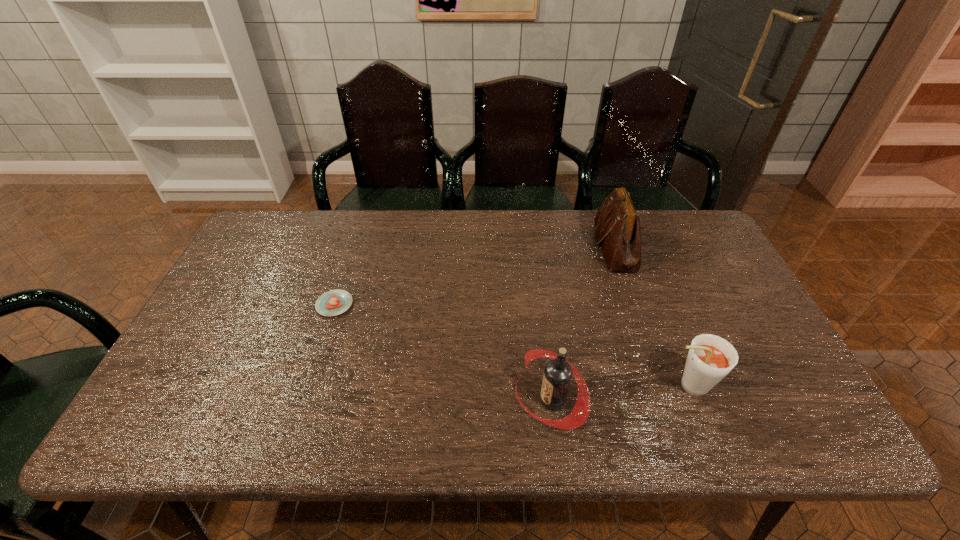
Where is `vacant space located on the drink side of the right root beer`? Image resolution: width=960 pixels, height=540 pixels. vacant space located on the drink side of the right root beer is located at coordinates (607, 386).

The width and height of the screenshot is (960, 540). I want to click on vacant space located 0.360m on the drink side of the right root beer, so click(x=510, y=386).

Identify the location of free space located on the back of the shortest object. (356, 237).

Find the location of a particular element. object that is at the far edge is located at coordinates (617, 224).

Image resolution: width=960 pixels, height=540 pixels. Identify the location of object at the near edge. (557, 376).

This screenshot has height=540, width=960. I want to click on vacant space at the far edge of the desktop, so click(341, 218).

In order to click on vacant space at the near edge in this screenshot , I will do `click(587, 430)`.

Image resolution: width=960 pixels, height=540 pixels. Find the location of `blank space at the left edge of the desktop`. blank space at the left edge of the desktop is located at coordinates (273, 267).

The image size is (960, 540). Find the location of `vacant region at the right edge`. vacant region at the right edge is located at coordinates (743, 378).

The height and width of the screenshot is (540, 960). In the image, there is a desktop. Find the location of `blank space at the far left corner`. blank space at the far left corner is located at coordinates (273, 212).